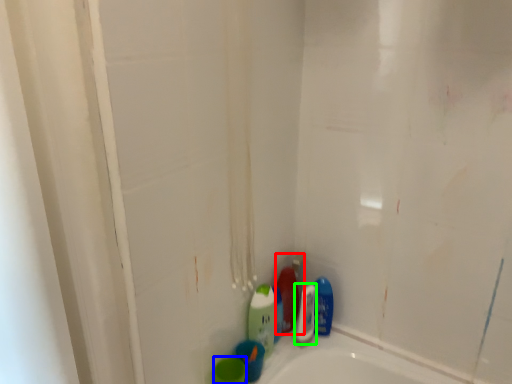
Question: Based on their relative distances, which object is nearer to cleaning product (highlighted by a red box)? Choose from mouthwash (highlighted by a blue box) and cleaning product (highlighted by a green box).

Choices:
 (A) mouthwash
 (B) cleaning product

Answer: (B)